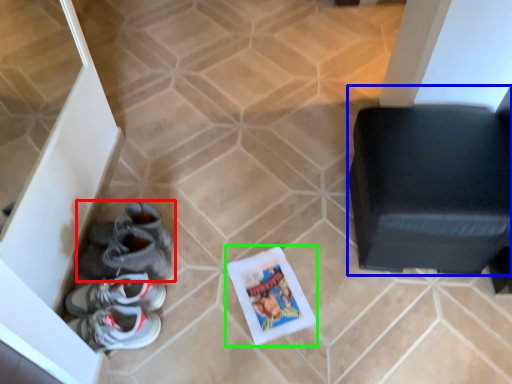
Question: Estimate the real-world distances between objects in this image. Which object is farther from footwear (highlighted by a red box), furniture (highlighted by a blue box) or comic book (highlighted by a green box)?

Choices:
 (A) furniture
 (B) comic book

Answer: (A)